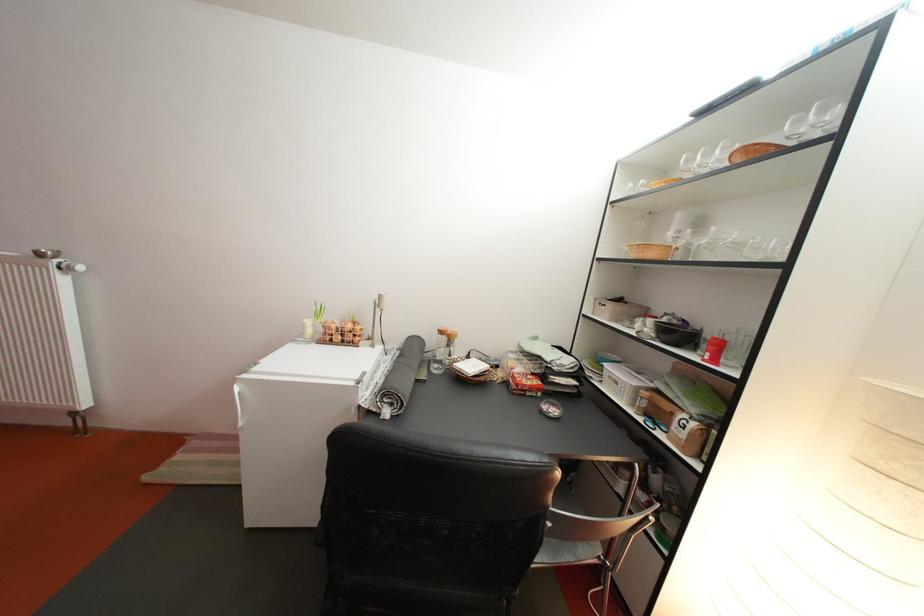
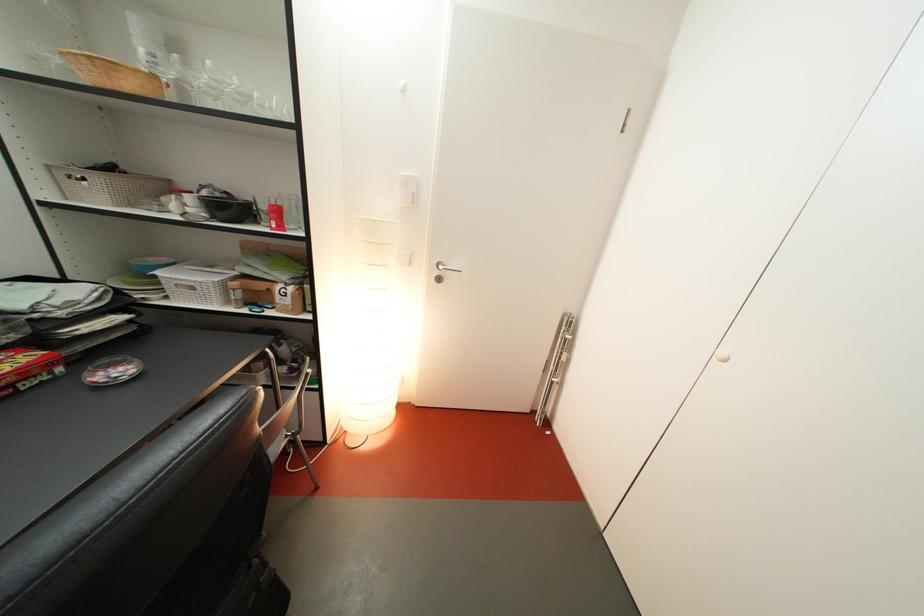
Find the pixel in the second image that matches point 691,249 in the first image.

(179, 82)